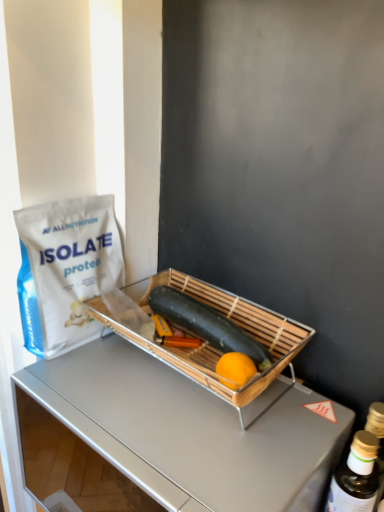
Question: Considering the relative sizes of white matte protein powder bag at left and metallic silver desk at center in the image provided, is white matte protein powder bag at left wider than metallic silver desk at center?

Choices:
 (A) yes
 (B) no

Answer: (B)

Question: Considering the relative positions of white matte protein powder bag at left and metallic silver desk at center in the image provided, is white matte protein powder bag at left to the left of metallic silver desk at center from the viewer's perspective?

Choices:
 (A) yes
 (B) no

Answer: (A)

Question: Considering the relative positions of white matte protein powder bag at left and metallic silver desk at center in the image provided, is white matte protein powder bag at left in front of metallic silver desk at center?

Choices:
 (A) yes
 (B) no

Answer: (B)

Question: Is white matte protein powder bag at left looking in the opposite direction of metallic silver desk at center?

Choices:
 (A) yes
 (B) no

Answer: (B)

Question: Is there a large distance between white matte protein powder bag at left and metallic silver desk at center?

Choices:
 (A) no
 (B) yes

Answer: (B)

Question: Is metallic silver desk at center completely or partially inside white matte protein powder bag at left?

Choices:
 (A) no
 (B) yes

Answer: (A)

Question: Is metallic silver desk at center facing towards smooth green zucchini at center?

Choices:
 (A) yes
 (B) no

Answer: (B)

Question: Does metallic silver desk at center lie behind smooth green zucchini at center?

Choices:
 (A) yes
 (B) no

Answer: (B)

Question: Is the depth of metallic silver desk at center less than that of smooth green zucchini at center?

Choices:
 (A) yes
 (B) no

Answer: (A)

Question: Does metallic silver desk at center contain smooth green zucchini at center?

Choices:
 (A) no
 (B) yes

Answer: (A)

Question: Is metallic silver desk at center wider than smooth green zucchini at center?

Choices:
 (A) no
 (B) yes

Answer: (B)

Question: Is metallic silver desk at center far away from smooth green zucchini at center?

Choices:
 (A) yes
 (B) no

Answer: (A)

Question: Considering the relative positions of bamboo tray at center and metallic silver desk at center in the image provided, is bamboo tray at center in front of metallic silver desk at center?

Choices:
 (A) yes
 (B) no

Answer: (B)